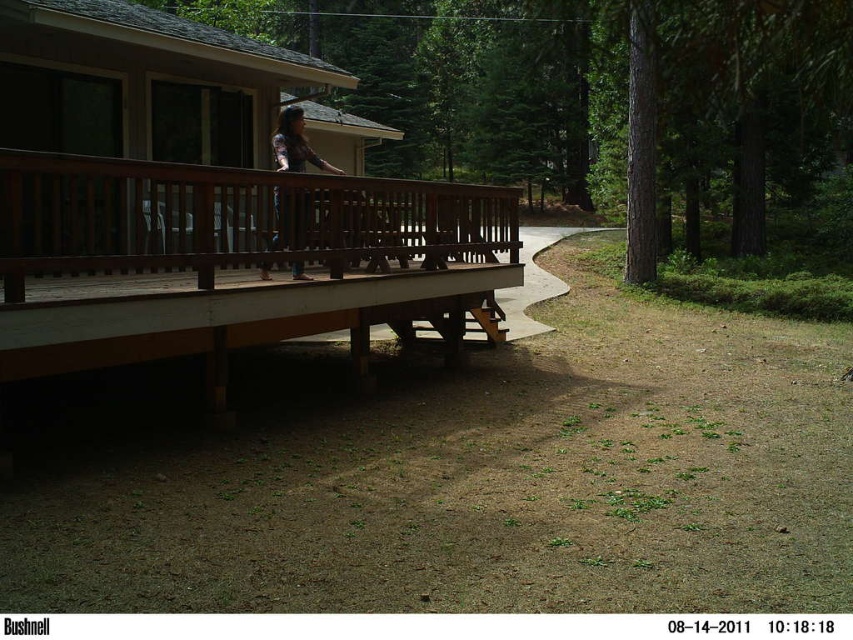
You are standing on the wooden deck and want to locate the brown wooden cabin at upper left. Based on its coordinates, in which direction should you look to see it?

The brown wooden cabin at upper left is located at coordinates point [143,83], so you should look towards the upper left direction to see it.

You are planning to place a large garden statue that requires a 3x3 meter space. Based on the scene, which object between the brown wooden porch at upper left and the brown wooden cabin at upper left would be more suitable for placing the statue?

The brown wooden cabin at upper left is larger in size compared to the brown wooden porch at upper left, so the brown wooden cabin at upper left would be more suitable for placing the large garden statue requiring a 3x3 meter space.